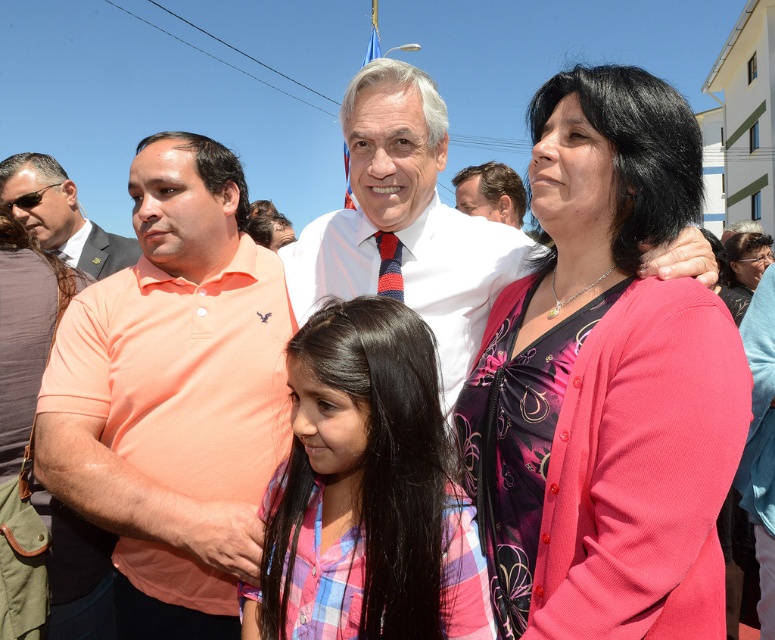
You are a photographer trying to capture a photo of the plaid fabric shirt at center and the red and blue striped tie at center. Which object should you focus on first if you want to ensure both are in sharp focus?

The plaid fabric shirt at center is positioned under the red and blue striped tie at center, so you should focus on the plaid fabric shirt at center first to ensure both are in sharp focus.

Looking at this image, you are a photographer trying to capture a clear shot of both the smooth white shirt at center and the red and blue striped tie at center. Since you want both items to be in focus, which one should you adjust your camera focus on first?

The smooth white shirt at center is closer to you than the red and blue striped tie at center. To ensure both are in focus, you should focus on the smooth white shirt at center first, as it is the closer object.

You are a photographer trying to capture the man in the center of the image. You need to focus your camera on his shirt first, then shift focus to his tie. Based on their positions in the image, which should you focus on first, the smooth white shirt at center or the red and blue striped tie at center?

You should focus on the smooth white shirt at center first because it is above the red and blue striped tie at center, so it is closer to the camera.